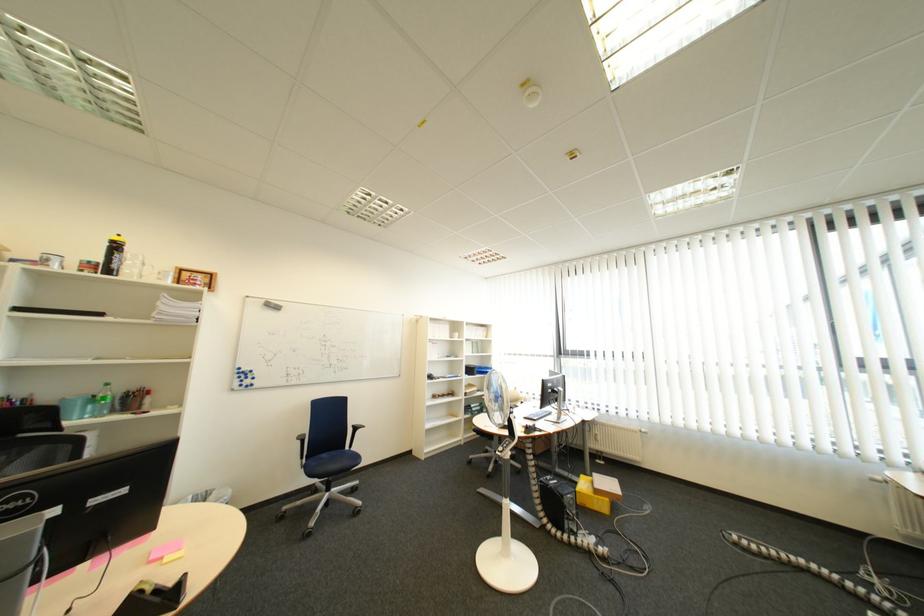
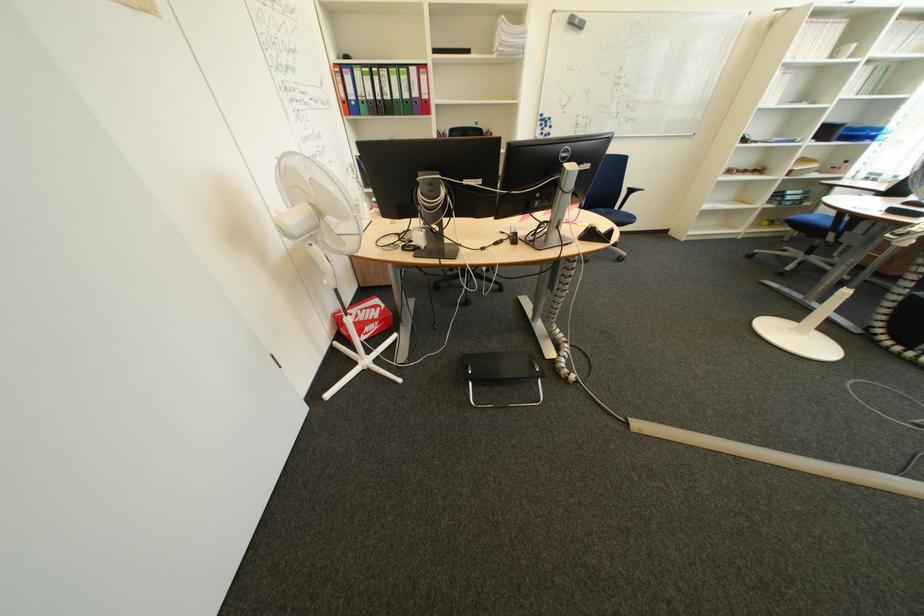
The point at [482,371] is marked in the first image. Where is the corresponding point in the second image?

(840, 132)